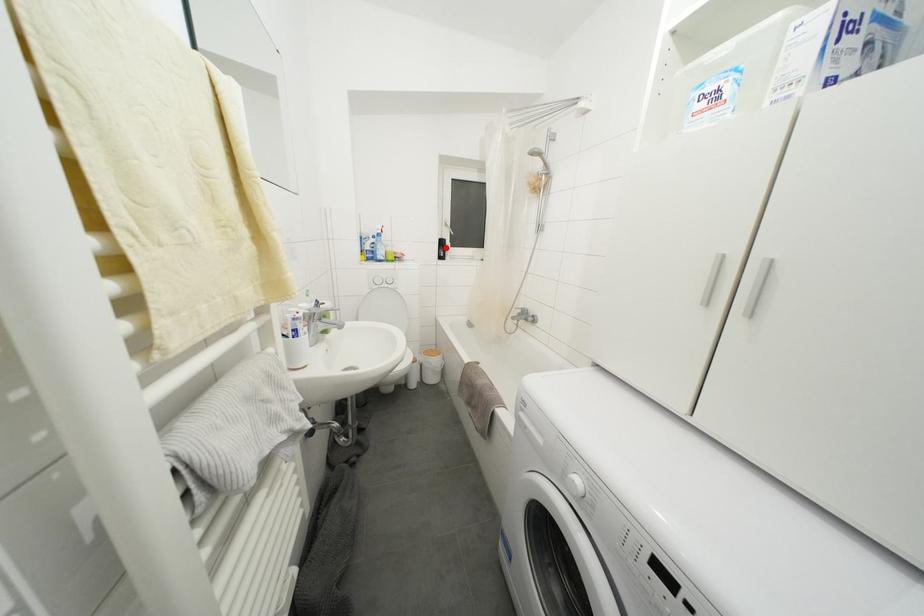
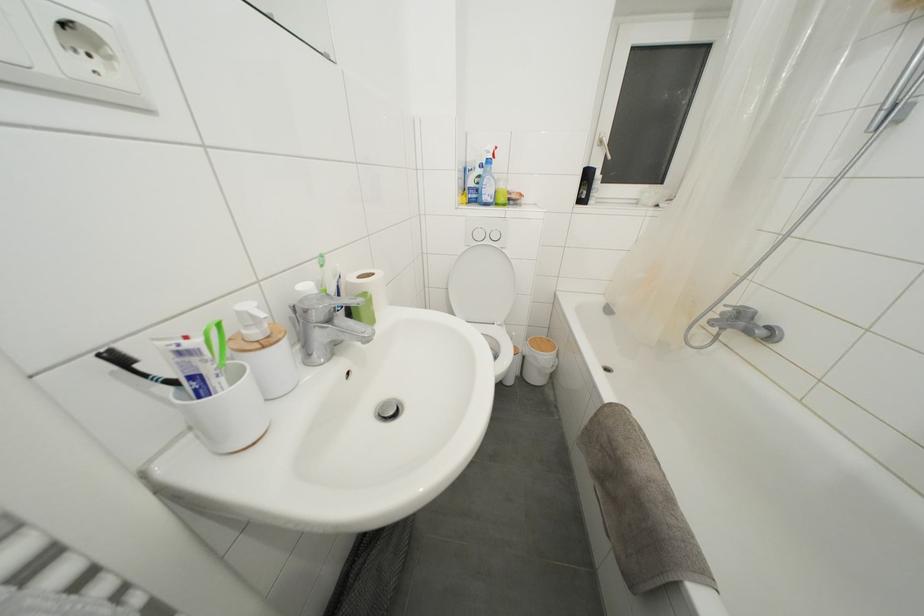
Find the pixel in the second image that matches the highlighted location in the first image.

(591, 180)